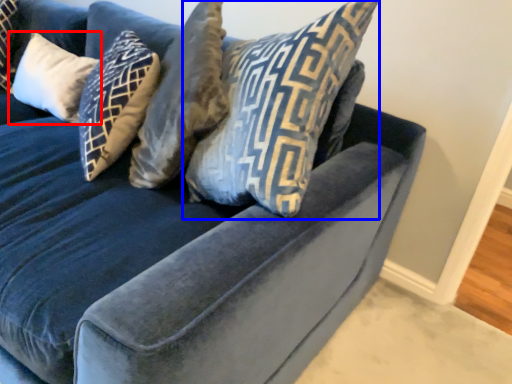
Question: Which point is further to the camera, pillow (highlighted by a red box) or pillow (highlighted by a blue box)?

Choices:
 (A) pillow
 (B) pillow

Answer: (A)